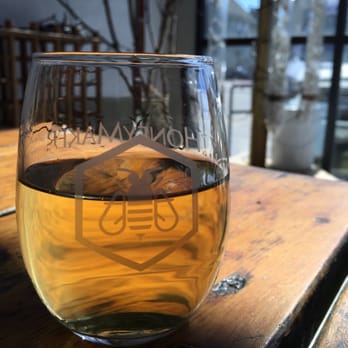
Locate an element on the screen. The width and height of the screenshot is (348, 348). clear glass is located at coordinates (117, 96).